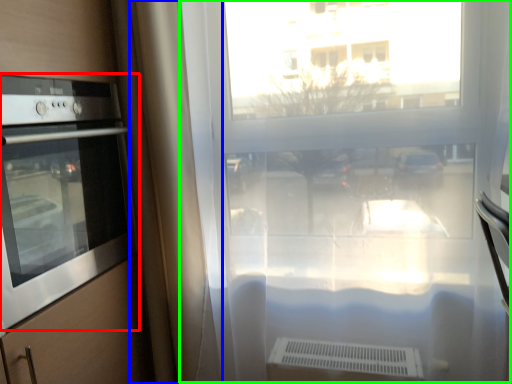
Question: Based on their relative distances, which object is farther from home appliance (highlighted by a red box)? Choose from curtain (highlighted by a blue box) and window frame (highlighted by a green box).

Choices:
 (A) curtain
 (B) window frame

Answer: (B)